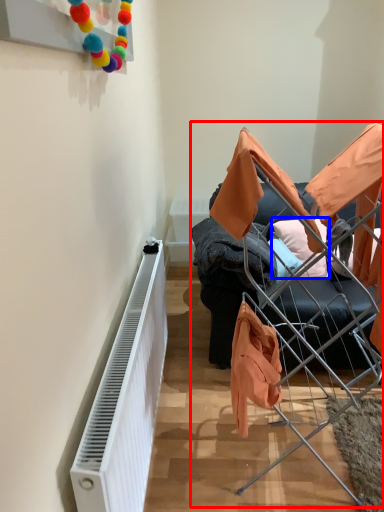
Question: Which of the following is the farthest to the observer, bunk bed (highlighted by a red box) or pillow (highlighted by a blue box)?

Choices:
 (A) bunk bed
 (B) pillow

Answer: (B)